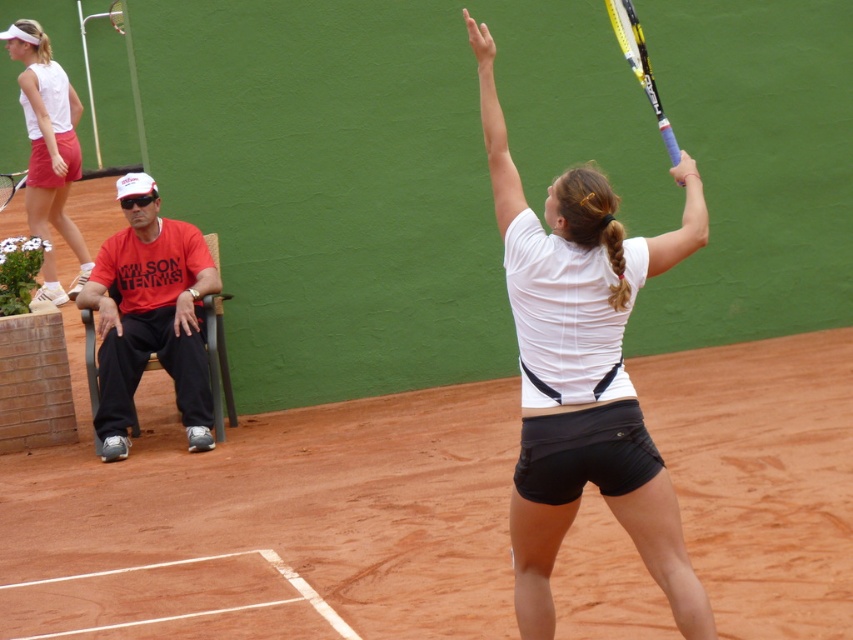
What do you see at coordinates (640, 65) in the screenshot?
I see `yellow and black racket at upper right` at bounding box center [640, 65].

Is yellow and black racket at upper right further to camera compared to black matte tennis racket at upper center?

No, it is in front of black matte tennis racket at upper center.

Is point (662, 115) more distant than point (6, 204)?

That is False.

The image size is (853, 640). I want to click on yellow and black racket at upper right, so click(640, 65).

Can you confirm if clay tennis court at center is wider than matte white tank top at upper left?

In fact, clay tennis court at center might be narrower than matte white tank top at upper left.

Measure the distance between point (277,529) and camera.

They are 25.95 feet apart.

You are a GUI agent. You are given a task and a screenshot of the screen. Output one action in this format:
    pyautogui.click(x=<x>, y=<y>)
    Task: Click on the clay tennis court at center
    
    Given the screenshot: What is the action you would take?
    pyautogui.click(x=299, y=506)

Between clay tennis court at center and yellow and black racket at upper right, which one has less height?

clay tennis court at center

Find the location of a particular element. This screenshot has width=853, height=640. clay tennis court at center is located at coordinates [x=299, y=506].